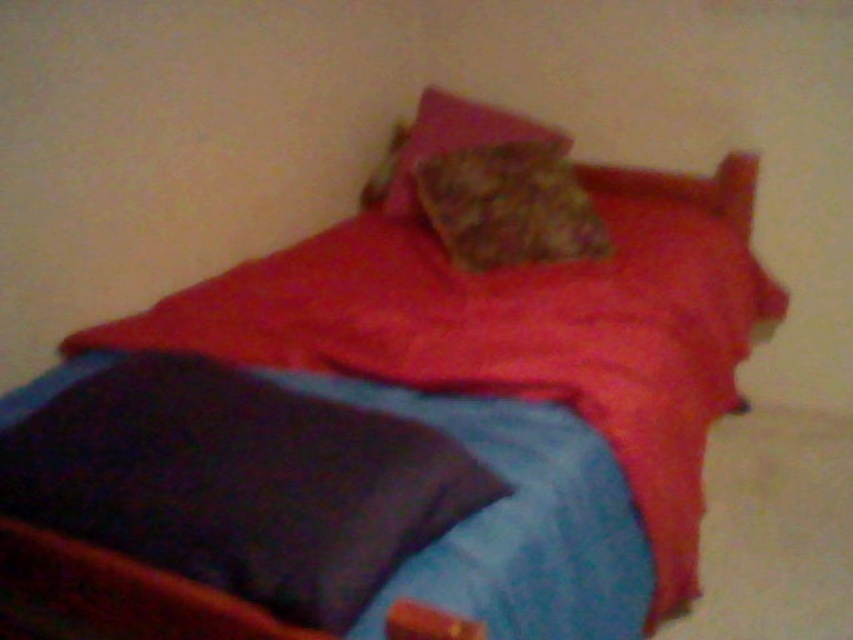
Question: Is the position of fluffy brown pillow at center less distant than that of fluffy pink pillow at upper center?

Choices:
 (A) no
 (B) yes

Answer: (B)

Question: Does blue fabric sheet at lower left come behind fluffy pink pillow at upper center?

Choices:
 (A) no
 (B) yes

Answer: (A)

Question: Which of the following is the farthest from the observer?

Choices:
 (A) (480, 157)
 (B) (566, 147)
 (C) (538, 515)

Answer: (B)

Question: Observing the image, what is the correct spatial positioning of fluffy brown pillow at center in reference to fluffy pink pillow at upper center?

Choices:
 (A) left
 (B) right

Answer: (B)

Question: Which point is closer to the camera taking this photo?

Choices:
 (A) (485, 508)
 (B) (463, 198)
 (C) (395, 136)

Answer: (A)

Question: Estimate the real-world distances between objects in this image. Which object is farther from the fluffy pink pillow at upper center?

Choices:
 (A) fluffy brown pillow at center
 (B) blue fabric sheet at lower left

Answer: (B)